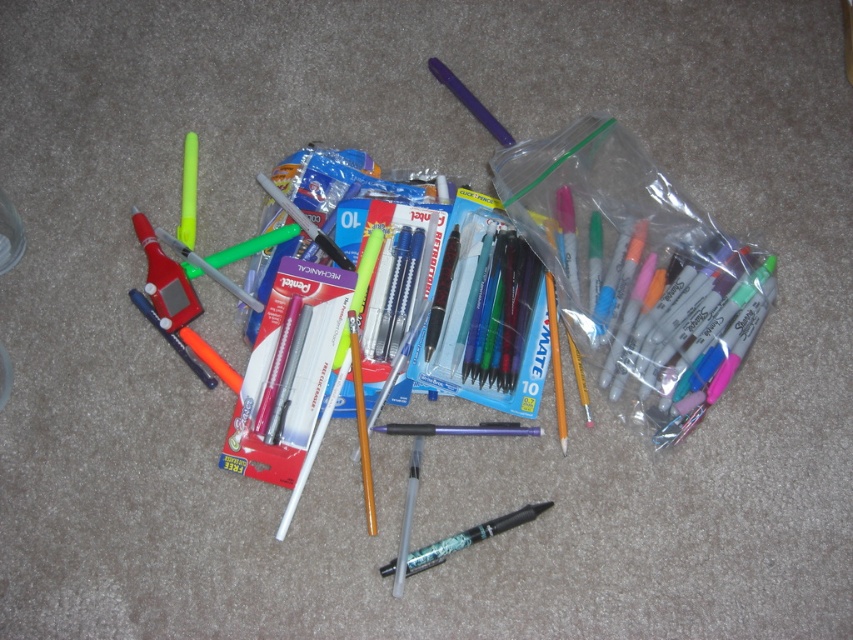
Where is the metallic green pen at center located in the image?

The metallic green pen at center is located at point (469, 538).

You need to choose a pen that can fit into a small pen holder. Which pen between the matte plastic pen at center and the matte purple pen at upper center would you select?

The matte plastic pen at center has a smaller size compared to the matte purple pen at upper center, so you should select the matte plastic pen at center for the small pen holder.

You are looking at the stationery items on the floor. Where is the matte plastic pen at center located in terms of its 2D coordinates?

The matte plastic pen at center is located at the 2D coordinates point (457, 429).